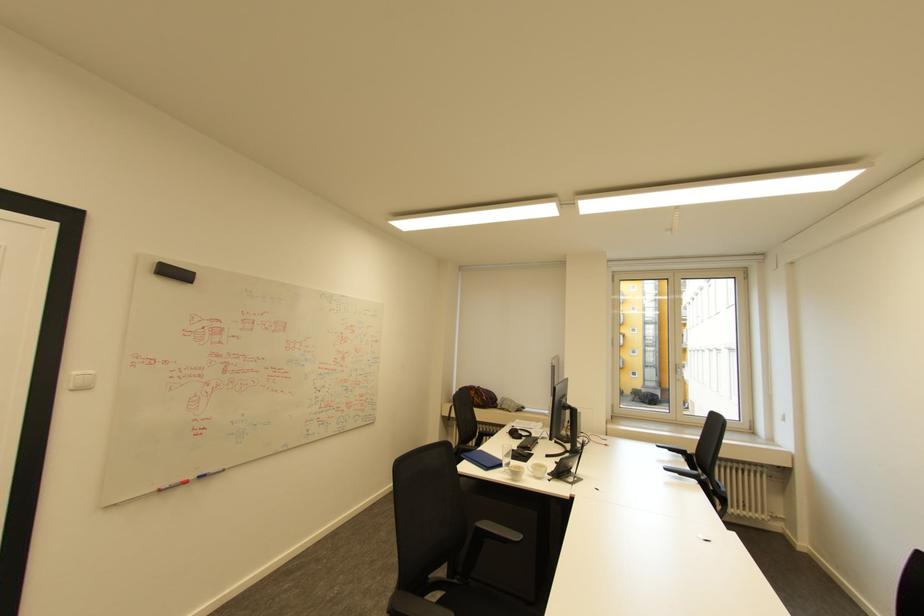
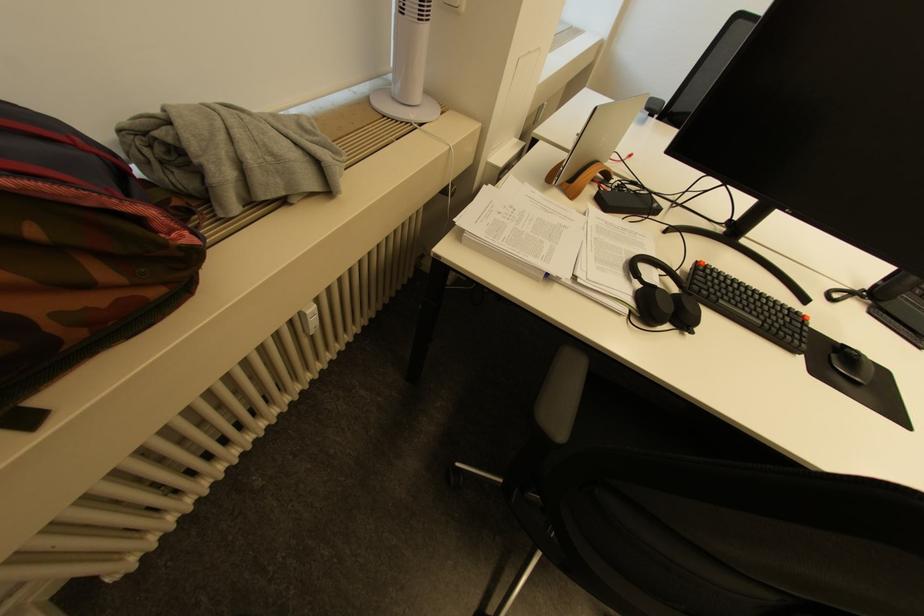
Where in the second image is the point corresponding to [491,398] from the first image?

(196, 238)